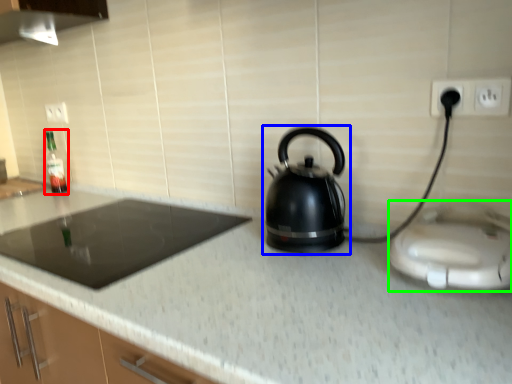
Question: Estimate the real-world distances between objects in this image. Which object is closer to bottle (highlighted by a red box), kettle (highlighted by a blue box) or appliance (highlighted by a green box)?

Choices:
 (A) kettle
 (B) appliance

Answer: (A)